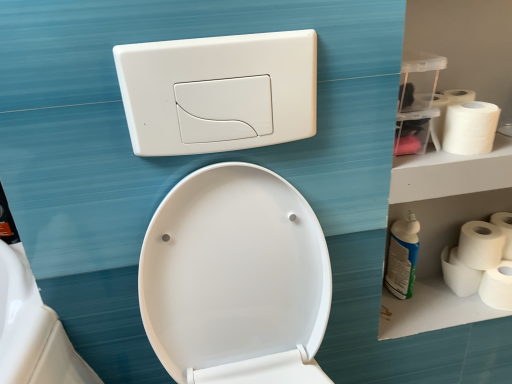
Question: Is white plastic flush plate at upper center smaller than white matte toilet paper at right, the first toilet paper in the bottom-to-top sequence?

Choices:
 (A) no
 (B) yes

Answer: (A)

Question: Is white plastic flush plate at upper center surrounding white matte toilet paper at right, the first toilet paper in the bottom-to-top sequence?

Choices:
 (A) yes
 (B) no

Answer: (B)

Question: Considering the relative positions of white plastic flush plate at upper center and white matte toilet paper at right, which ranks as the fifth toilet paper in top-to-bottom order, in the image provided, is white plastic flush plate at upper center to the right of white matte toilet paper at right, which ranks as the fifth toilet paper in top-to-bottom order, from the viewer's perspective?

Choices:
 (A) no
 (B) yes

Answer: (A)

Question: Considering the relative positions of white plastic flush plate at upper center and white matte toilet paper at right, the first toilet paper in the bottom-to-top sequence, in the image provided, is white plastic flush plate at upper center behind white matte toilet paper at right, the first toilet paper in the bottom-to-top sequence,?

Choices:
 (A) yes
 (B) no

Answer: (B)

Question: Is white plastic flush plate at upper center oriented towards white matte toilet paper at right, which ranks as the fifth toilet paper in top-to-bottom order?

Choices:
 (A) yes
 (B) no

Answer: (B)

Question: From the image's perspective, relative to blue glossy spray bottle at right, is white matte toilet paper at right, placed as the third toilet paper when sorted from bottom to top, above or below?

Choices:
 (A) above
 (B) below

Answer: (A)

Question: In the image, is white matte toilet paper at right, which appears as the third toilet paper when viewed from the top, on the left side or the right side of blue glossy spray bottle at right?

Choices:
 (A) left
 (B) right

Answer: (B)

Question: From a real-world perspective, relative to blue glossy spray bottle at right, is white matte toilet paper at right, which appears as the third toilet paper when viewed from the top, vertically above or below?

Choices:
 (A) above
 (B) below

Answer: (A)

Question: From their relative heights in the image, would you say white matte toilet paper at right, placed as the third toilet paper when sorted from bottom to top, is taller or shorter than blue glossy spray bottle at right?

Choices:
 (A) tall
 (B) short

Answer: (B)

Question: In terms of width, does white matte toilet paper at right, the first toilet paper in the bottom-to-top sequence, look wider or thinner when compared to white matte toilet paper at right, placed as the third toilet paper when sorted from bottom to top?

Choices:
 (A) wide
 (B) thin

Answer: (B)

Question: Visually, is white matte toilet paper at right, which ranks as the fifth toilet paper in top-to-bottom order, positioned to the left or to the right of white matte toilet paper at right, which appears as the third toilet paper when viewed from the top?

Choices:
 (A) right
 (B) left

Answer: (A)

Question: Does point pos(484,271) appear closer or farther from the camera than point pos(472,221)?

Choices:
 (A) closer
 (B) farther

Answer: (A)

Question: Based on their sizes in the image, would you say white matte toilet paper at right, which ranks as the fifth toilet paper in top-to-bottom order, is bigger or smaller than white matte toilet paper at right, placed as the third toilet paper when sorted from bottom to top?

Choices:
 (A) small
 (B) big

Answer: (A)

Question: From a real-world perspective, is white matte toilet paper at right, which ranks as the fifth toilet paper in top-to-bottom order, above or below blue glossy spray bottle at right?

Choices:
 (A) below
 (B) above

Answer: (A)

Question: Considering the positions of white matte toilet paper at right, which ranks as the fifth toilet paper in top-to-bottom order, and blue glossy spray bottle at right in the image, is white matte toilet paper at right, which ranks as the fifth toilet paper in top-to-bottom order, taller or shorter than blue glossy spray bottle at right?

Choices:
 (A) short
 (B) tall

Answer: (A)